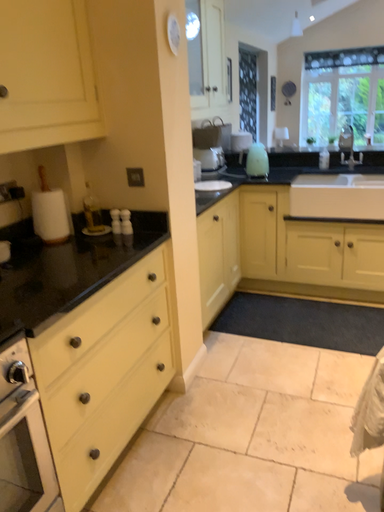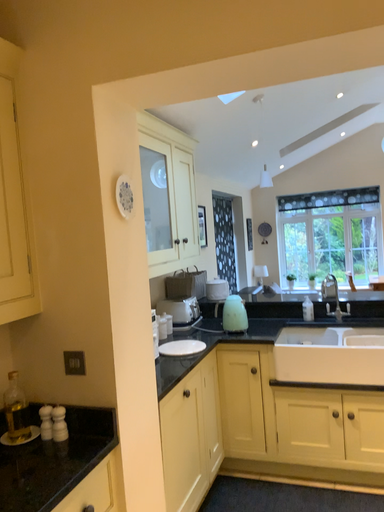
Question: How did the camera likely rotate when shooting the video?

Choices:
 (A) rotated downward
 (B) rotated upward

Answer: (B)